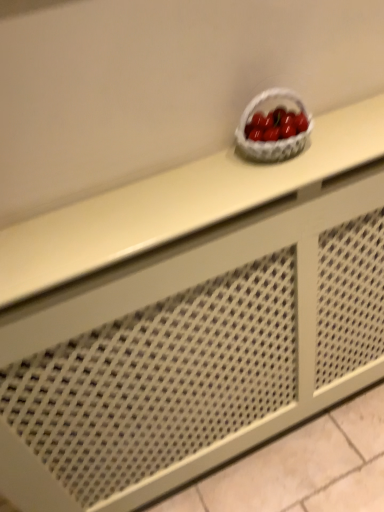
This screenshot has width=384, height=512. What do you see at coordinates (276, 141) in the screenshot?
I see `white textured basket at upper center` at bounding box center [276, 141].

I want to click on white textured basket at upper center, so pyautogui.click(x=276, y=141).

At what (x,y) coordinates should I click in order to perform the action: click on white textured basket at upper center. Please return your answer as a coordinate pair (x, y). The height and width of the screenshot is (512, 384). Looking at the image, I should click on (276, 141).